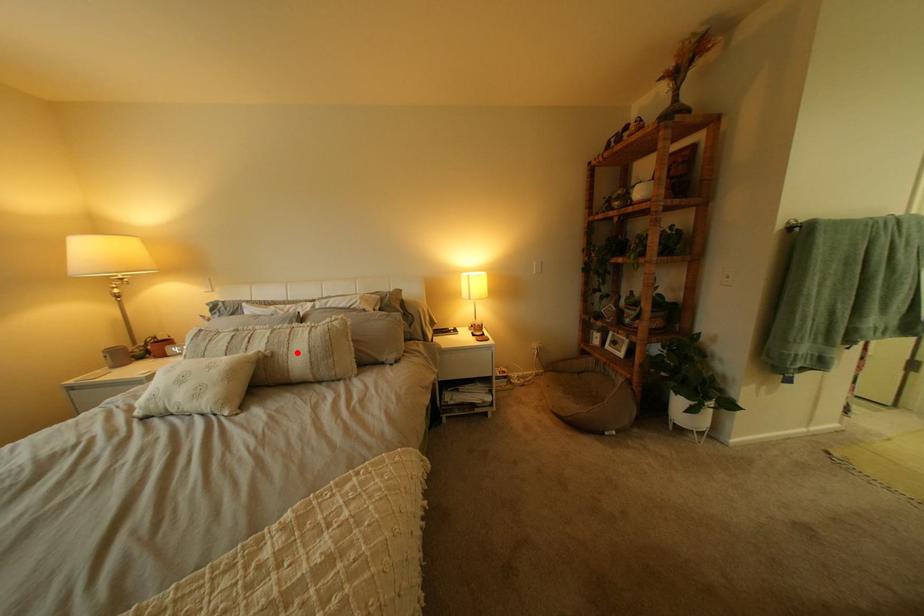
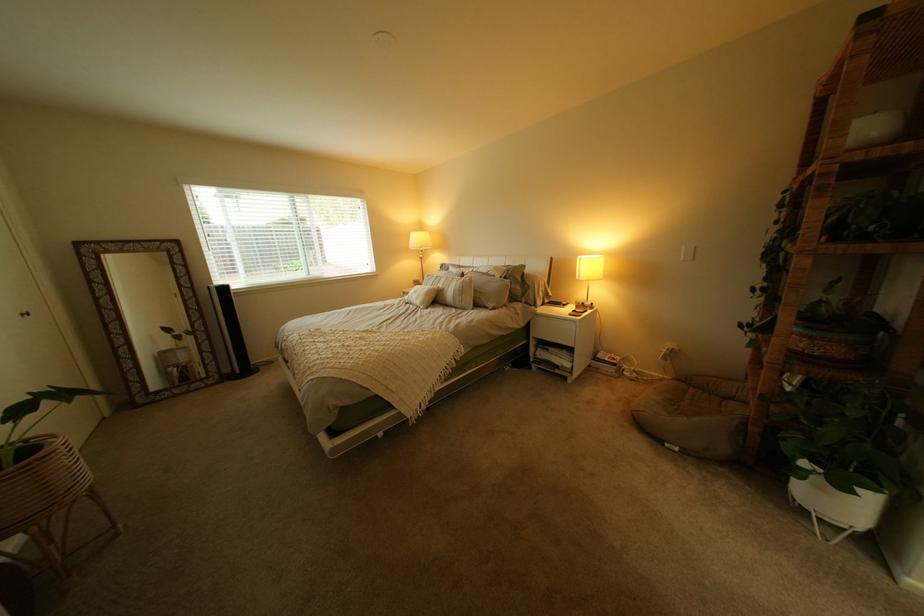
Locate, in the second image, the point that corresponds to the highlighted location in the first image.

(462, 290)